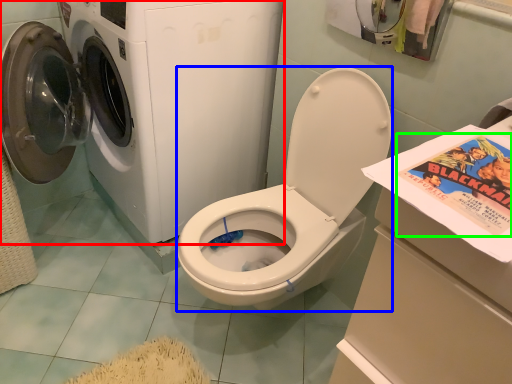
Question: Estimate the real-world distances between objects in this image. Which object is farther from washing machine (highlighted by a red box), washer (highlighted by a blue box) or comic book (highlighted by a green box)?

Choices:
 (A) washer
 (B) comic book

Answer: (B)